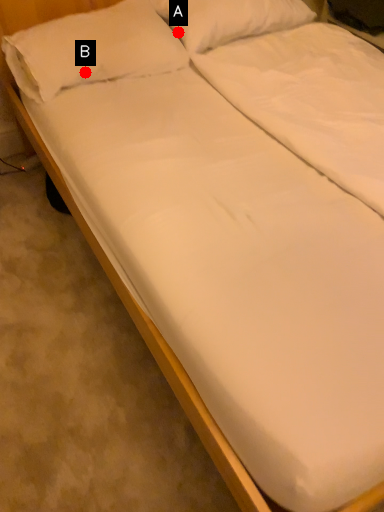
Question: Two points are circled on the image, labeled by A and B beside each circle. Which point is closer to the camera?

Choices:
 (A) A is closer
 (B) B is closer

Answer: (B)